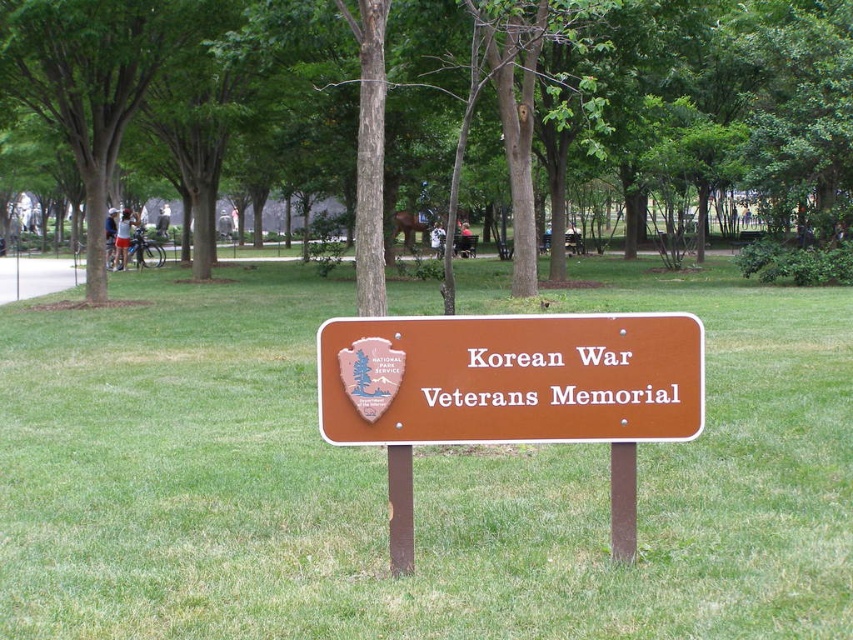
Which is behind, point (828, 186) or point (335, 353)?

Point (828, 186)

Who is higher up, green leafy tree at center or brown wooden sign at center?

green leafy tree at center

The width and height of the screenshot is (853, 640). Identify the location of green leafy tree at center. (456, 97).

Is green grassy at center further to the viewer compared to brown wooden sign at center?

No, it is not.

Can you confirm if green grassy at center is bigger than brown wooden sign at center?

Yes.

Between point (62, 426) and point (393, 396), which one is positioned in front?

Positioned in front is point (393, 396).

The width and height of the screenshot is (853, 640). In order to click on green grassy at center in this screenshot , I will do `click(415, 477)`.

Does green grassy at center have a lesser width compared to green leafy tree at center?

Correct, green grassy at center's width is less than green leafy tree at center's.

Does green grassy at center have a larger size compared to green leafy tree at center?

Incorrect, green grassy at center is not larger than green leafy tree at center.

Between point (180, 305) and point (141, 80), which one is positioned in front?

Point (180, 305)

The height and width of the screenshot is (640, 853). Identify the location of green grassy at center. (415, 477).